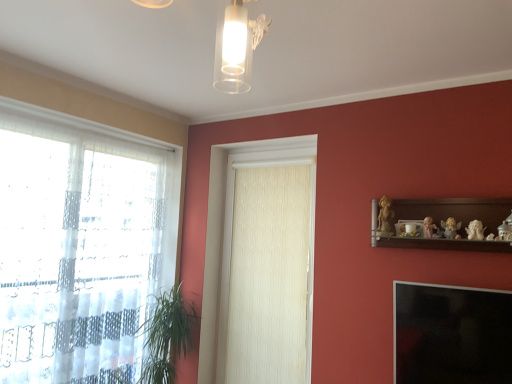
Question: Is transparent glass window screen at lower right far from transparent fabric at left?

Choices:
 (A) yes
 (B) no

Answer: (A)

Question: Is transparent glass window screen at lower right taller than transparent fabric at left?

Choices:
 (A) yes
 (B) no

Answer: (B)

Question: Is the position of transparent glass window screen at lower right less distant than that of transparent fabric at left?

Choices:
 (A) yes
 (B) no

Answer: (A)

Question: From a real-world perspective, does transparent glass window screen at lower right sit lower than transparent fabric at left?

Choices:
 (A) yes
 (B) no

Answer: (A)

Question: Is transparent glass window screen at lower right facing towards transparent fabric at left?

Choices:
 (A) no
 (B) yes

Answer: (A)

Question: Can we say transparent glass window screen at lower right lies outside transparent fabric at left?

Choices:
 (A) no
 (B) yes

Answer: (B)

Question: From a real-world perspective, does matte gold angel at upper right, the 3th toy when ordered from right to left, sit lower than matte white figurine at upper right, marked as the 4th toy in a right-to-left arrangement?

Choices:
 (A) no
 (B) yes

Answer: (B)

Question: Considering the relative positions of matte gold angel at upper right, the 3th toy when ordered from right to left, and matte white figurine at upper right, arranged as the 2th toy when viewed from the left, in the image provided, is matte gold angel at upper right, the 3th toy when ordered from right to left, to the left of matte white figurine at upper right, arranged as the 2th toy when viewed from the left, from the viewer's perspective?

Choices:
 (A) no
 (B) yes

Answer: (A)

Question: Is matte gold angel at upper right, the 3th toy when ordered from right to left, facing towards matte white figurine at upper right, marked as the 4th toy in a right-to-left arrangement?

Choices:
 (A) yes
 (B) no

Answer: (B)

Question: Would you say matte gold angel at upper right, the 3th toy when ordered from right to left, is a long distance from matte white figurine at upper right, marked as the 4th toy in a right-to-left arrangement?

Choices:
 (A) no
 (B) yes

Answer: (A)

Question: Does matte gold angel at upper right, which appears as the 3th toy when viewed from the left, have a lesser width compared to matte white figurine at upper right, marked as the 4th toy in a right-to-left arrangement?

Choices:
 (A) yes
 (B) no

Answer: (B)

Question: From a real-world perspective, is matte gold angel at upper right, which appears as the 3th toy when viewed from the left, physically above matte white figurine at upper right, arranged as the 2th toy when viewed from the left?

Choices:
 (A) no
 (B) yes

Answer: (A)

Question: From a real-world perspective, is transparent glass window screen at lower right positioned under matte gold angel at upper right, the 3th toy when ordered from right to left, based on gravity?

Choices:
 (A) no
 (B) yes

Answer: (B)